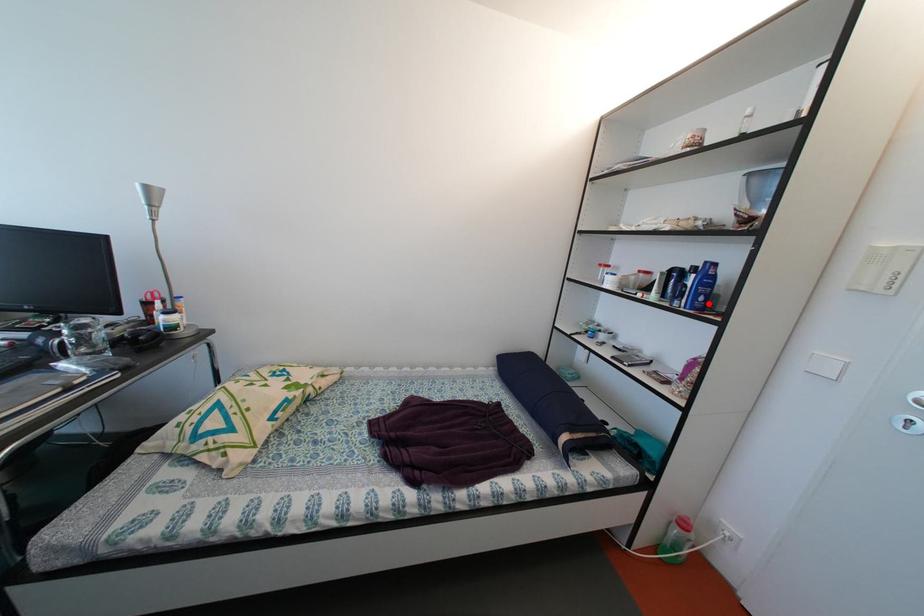
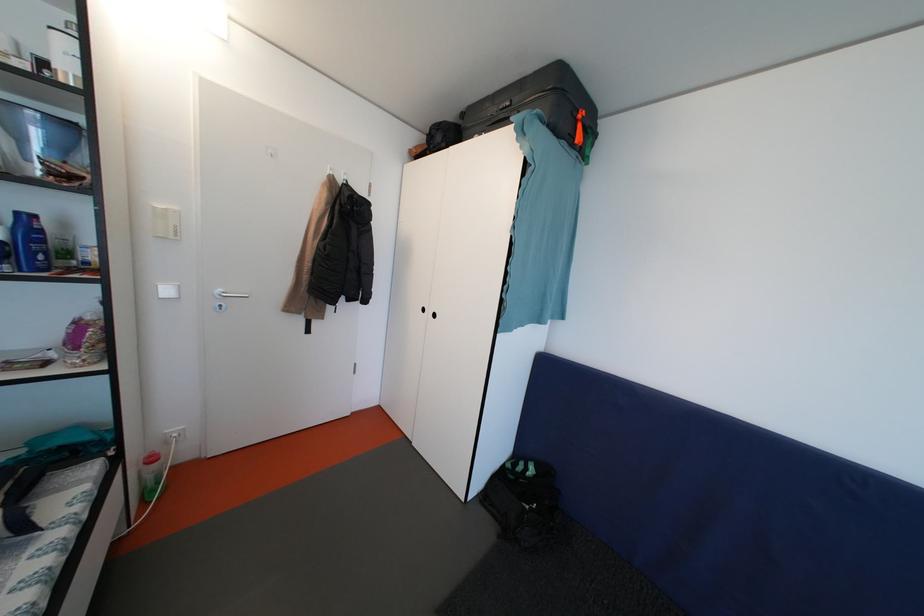
In the second image, find the point that corresponds to the highlighted location in the first image.

(49, 262)